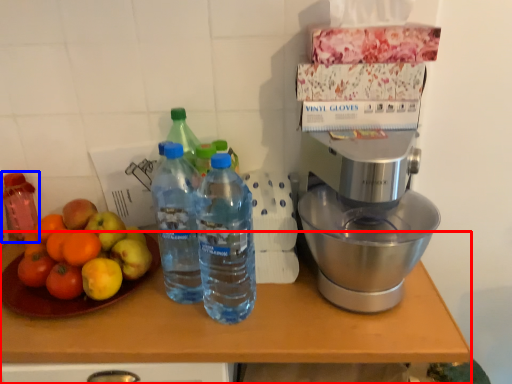
Question: Among these objects, which one is nearest to the camera, table (highlighted by a red box) or bottle (highlighted by a blue box)?

Choices:
 (A) table
 (B) bottle

Answer: (A)